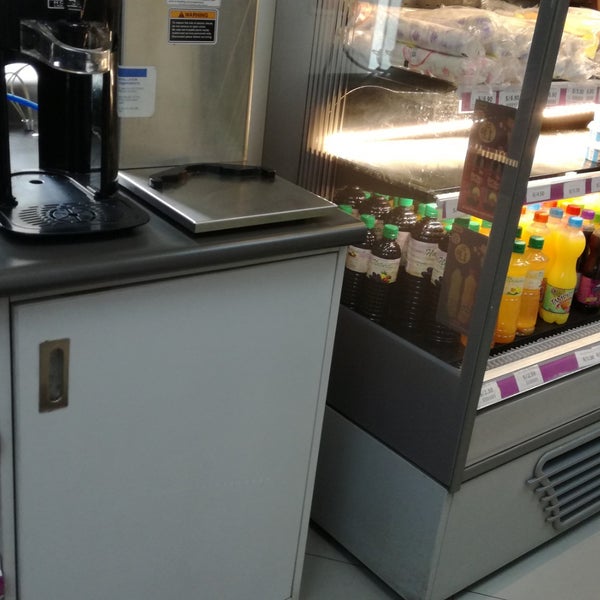
Where is `yellow and black label on commercial coffee maker`? yellow and black label on commercial coffee maker is located at coordinates (198, 28).